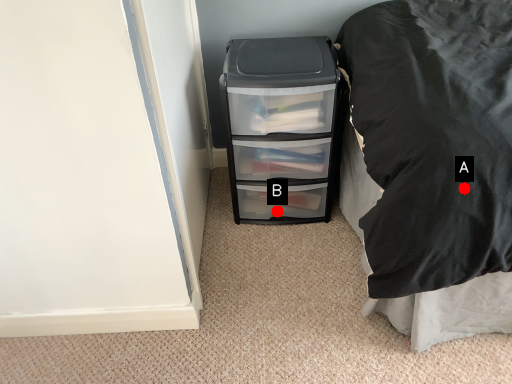
Question: Two points are circled on the image, labeled by A and B beside each circle. Among these points, which one is farthest from the camera?

Choices:
 (A) A is further
 (B) B is further

Answer: (B)